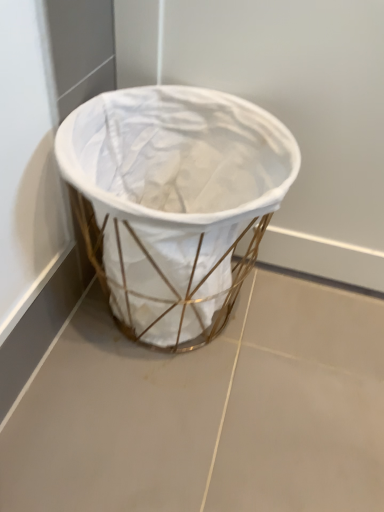
The height and width of the screenshot is (512, 384). What do you see at coordinates (175, 201) in the screenshot?
I see `gold wire mesh waste bin at center` at bounding box center [175, 201].

The height and width of the screenshot is (512, 384). Identify the location of gold wire mesh waste bin at center. (175, 201).

Where is `gold wire mesh waste bin at center`? Image resolution: width=384 pixels, height=512 pixels. gold wire mesh waste bin at center is located at coordinates (175, 201).